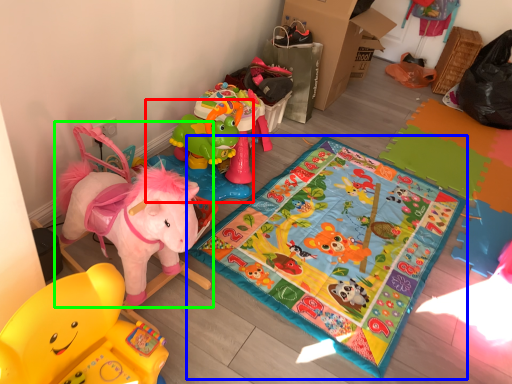
Question: Which is farther away from toy (highlighted by a red box)? yoga mat (highlighted by a blue box) or toy (highlighted by a green box)?

Choices:
 (A) yoga mat
 (B) toy

Answer: (B)